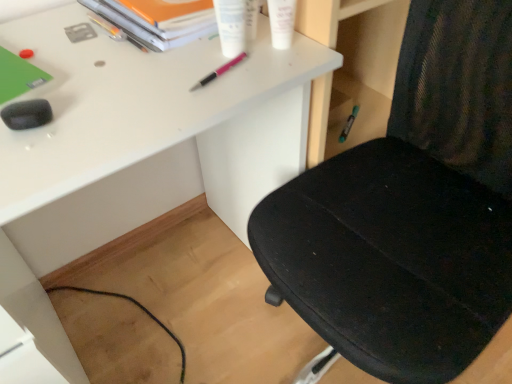
Identify the location of free location to the right of matte black earbuds at left, the first stationery when ordered from left to right. This screenshot has height=384, width=512. (131, 103).